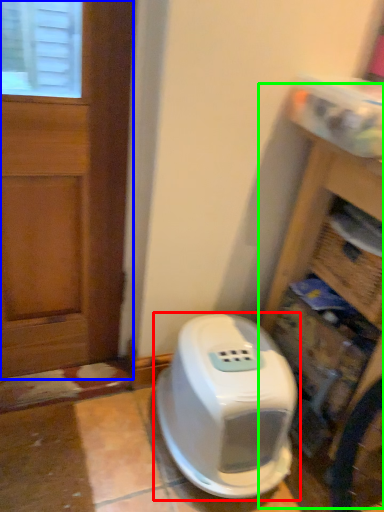
Question: Which object is positioned farthest from home appliance (highlighted by a red box)? Select from door (highlighted by a blue box) and bookshelf (highlighted by a green box).

Choices:
 (A) door
 (B) bookshelf

Answer: (A)